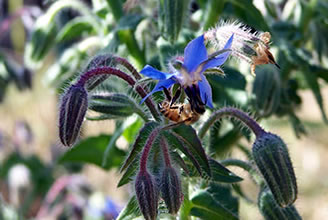
This screenshot has width=328, height=220. What are the coordinates of `additional background plants` in the screenshot? It's located at pos(17,25), pos(21,177), pos(61,194), pos(85,203).